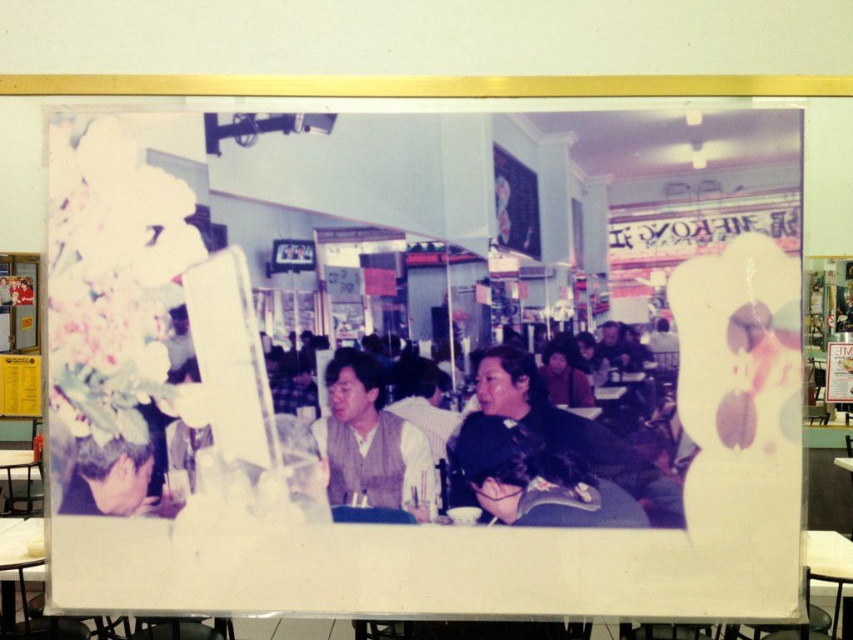
Does light brown vest at center come in front of blonde hair at lower left?

Yes.

Who is taller, light brown vest at center or blonde hair at lower left?

Standing taller between the two is light brown vest at center.

Does point (328, 465) come in front of point (169, 497)?

No, it is not.

I want to click on light brown vest at center, so click(370, 442).

From the picture: Is dark brown hair at center below blonde hair at lower left?

Correct, dark brown hair at center is located below blonde hair at lower left.

Which is above, dark brown hair at center or blonde hair at lower left?

blonde hair at lower left is above.

Does point (489, 435) lie behind point (166, 420)?

No, it is not.

This screenshot has width=853, height=640. What are the coordinates of `dark brown hair at center` in the screenshot? It's located at (532, 480).

Consider the image. How distant is dark brown hair at center from light brown vest at center?

dark brown hair at center and light brown vest at center are 8.62 inches apart.

Based on the photo, can you confirm if dark brown hair at center is wider than light brown vest at center?

Yes.

Who is more forward, (531, 470) or (430, 509)?

Point (531, 470) is more forward.

This screenshot has height=640, width=853. Find the location of `dark brown hair at center`. dark brown hair at center is located at coordinates (532, 480).